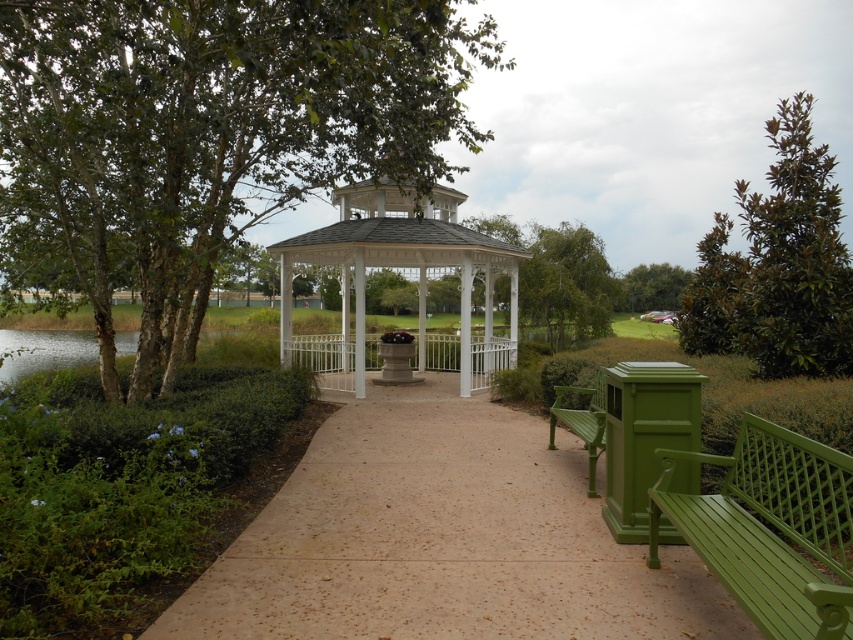
At what (x,y) coordinates should I click in order to perform the action: click on green leafy tree at upper left. Please return your answer as a coordinate pair (x, y). Image resolution: width=853 pixels, height=640 pixels. Looking at the image, I should click on (206, 136).

In the scene shown: Is green leafy tree at upper left positioned behind green leafy tree at center?

No, it is in front of green leafy tree at center.

Does point (194, 253) lie behind point (577, 310)?

No.

This screenshot has height=640, width=853. Identify the location of green leafy tree at upper left. (206, 136).

Between brown concrete path at center and green leafy tree at upper center, which one is positioned higher?

green leafy tree at upper center

Does brown concrete path at center have a greater height compared to green leafy tree at upper center?

In fact, brown concrete path at center may be shorter than green leafy tree at upper center.

At what (x,y) coordinates should I click in order to perform the action: click on brown concrete path at center. Please return your answer as a coordinate pair (x, y). Looking at the image, I should click on (444, 540).

Is the position of green leafy tree at upper right less distant than that of white painted metal gazebo at center?

Yes.

Is green leafy tree at upper right smaller than white painted metal gazebo at center?

No, green leafy tree at upper right is not smaller than white painted metal gazebo at center.

The height and width of the screenshot is (640, 853). What are the coordinates of `green leafy tree at upper right` in the screenshot? It's located at (778, 266).